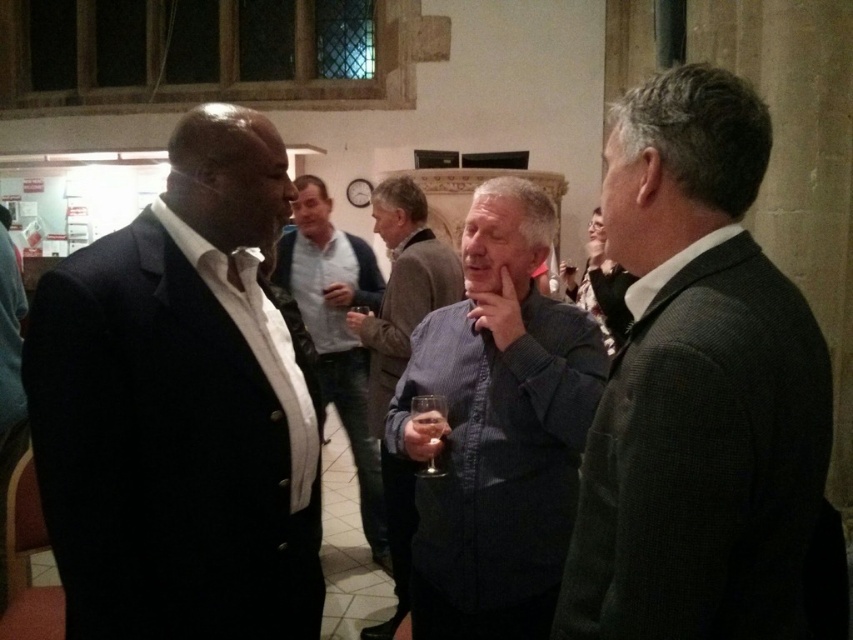
Who is lower down, dark blue textured shirt at center or gray striped shirt at center?

gray striped shirt at center

Does point (567, 493) come behind point (370, 630)?

No, (567, 493) is closer to viewer.

The image size is (853, 640). Find the location of `dark blue textured shirt at center`. dark blue textured shirt at center is located at coordinates (497, 428).

You are a GUI agent. You are given a task and a screenshot of the screen. Output one action in this format:
    pyautogui.click(x=<x>, y=<y>)
    Task: Click on the matte black suit at left
    The width and height of the screenshot is (853, 640).
    Given the screenshot: What is the action you would take?
    pyautogui.click(x=180, y=408)

Does point (134, 554) come closer to viewer compared to point (598, 417)?

No, (134, 554) is behind (598, 417).

Between point (177, 412) and point (757, 592), which one is positioned behind?

The point (177, 412) is more distant.

At what (x,y) coordinates should I click in order to perform the action: click on matte black suit at left. Please return your answer as a coordinate pair (x, y). The width and height of the screenshot is (853, 640). Looking at the image, I should click on (180, 408).

Can you confirm if dark gray suit at right is smaller than matte black shirt at center?

Yes.

Which of these two, dark gray suit at right or matte black shirt at center, stands shorter?

Standing shorter between the two is dark gray suit at right.

Measure the distance between dark gray suit at right and camera.

dark gray suit at right is 1.08 meters away from camera.

You are a GUI agent. You are given a task and a screenshot of the screen. Output one action in this format:
    pyautogui.click(x=<x>, y=<y>)
    Task: Click on the dark gray suit at right
    The image size is (853, 640).
    Given the screenshot: What is the action you would take?
    pyautogui.click(x=701, y=394)